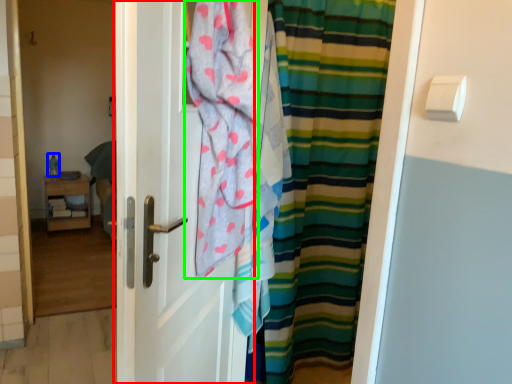
Question: Which object is the closest to the door (highlighted by a red box)? Choose among these: teal (highlighted by a blue box) or beach towel (highlighted by a green box).

Choices:
 (A) teal
 (B) beach towel

Answer: (B)